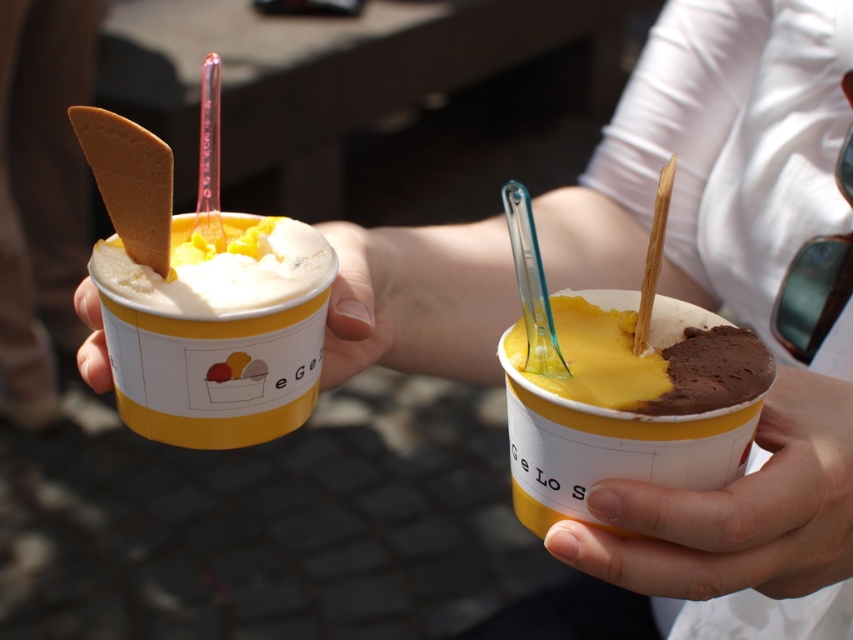
Can you confirm if smooth yellow ice cream cup at center is positioned to the right of yellow creamy ice cream at center?

Yes, smooth yellow ice cream cup at center is to the right of yellow creamy ice cream at center.

Which of these two, smooth yellow ice cream cup at center or yellow creamy ice cream at center, stands shorter?

yellow creamy ice cream at center

Does point (712, 184) come in front of point (724, 376)?

That is False.

Identify the location of smooth yellow ice cream cup at center. (727, 305).

Which is behind, point (659, 118) or point (254, 323)?

The point (659, 118) is more distant.

Between smooth yellow ice cream cup at center and yellow matte ice cream cup at left, which one appears on the right side from the viewer's perspective?

smooth yellow ice cream cup at center is more to the right.

The height and width of the screenshot is (640, 853). Identify the location of smooth yellow ice cream cup at center. (727, 305).

You are a GUI agent. You are given a task and a screenshot of the screen. Output one action in this format:
    pyautogui.click(x=<x>, y=<y>)
    Task: Click on the smooth yellow ice cream cup at center
    The width and height of the screenshot is (853, 640).
    Given the screenshot: What is the action you would take?
    pyautogui.click(x=727, y=305)

Is the position of yellow matte ice cream cup at left more distant than that of smooth skin hand at lower right?

Yes, yellow matte ice cream cup at left is behind smooth skin hand at lower right.

This screenshot has width=853, height=640. What are the coordinates of `yellow matte ice cream cup at left` in the screenshot? It's located at click(x=218, y=333).

This screenshot has width=853, height=640. Identify the location of yellow matte ice cream cup at left. (218, 333).